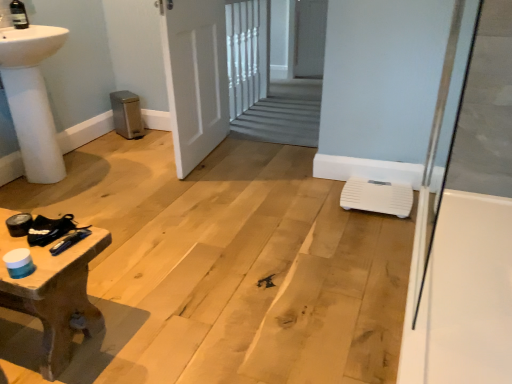
Locate an element on the screen. Image resolution: width=512 pixels, height=384 pixels. free point in front of metallic blue screwdriver at lower left is located at coordinates (52, 261).